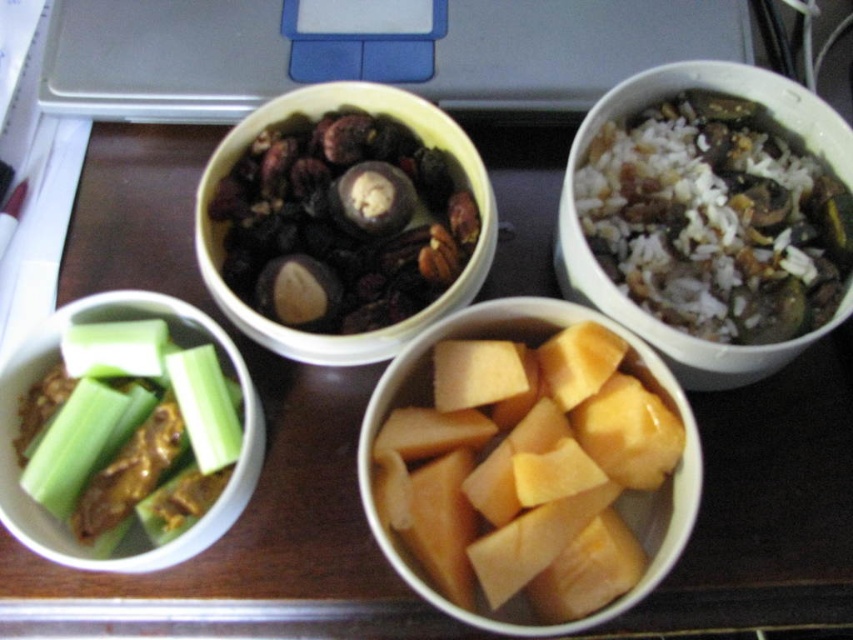
You are arranging a picnic basket and need to place the green matte celery at lower left and brown matte nuts and dried fruits at center into the basket. Which item should you place first to ensure the other can be seen from the top?

You should place the green matte celery at lower left first because it is behind the brown matte nuts and dried fruits at center, so placing it first allows the nuts and dried fruits to be visible on top.

You are a food delivery person who needs to stack these two items on a tray. The yellowish matte pumpkin at center and the brown matte nuts and dried fruits at center. Which one should you place at the bottom to prevent the stack from toppling over?

The yellowish matte pumpkin at center is much taller than the brown matte nuts and dried fruits at center. To prevent the stack from toppling over, place the taller item, the yellowish matte pumpkin at center, at the bottom since it has a larger base and can support the weight better.

You are standing at the edge of the table and want to place a small napkin at the point marked by coordinates point (616,500). Based on the scene description, where exactly on the table will the napkin be placed?

The point (616,500) is on the yellowish matte pumpkin at center, so the napkin will be placed on top of the yellowish matte pumpkin at center.